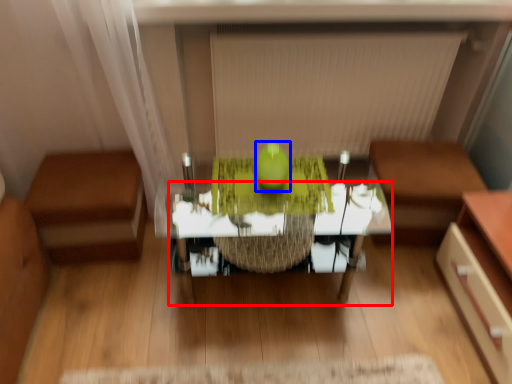
Question: Which of the following is the closest to the observer, table (highlighted by a red box) or apple (highlighted by a blue box)?

Choices:
 (A) table
 (B) apple

Answer: (A)